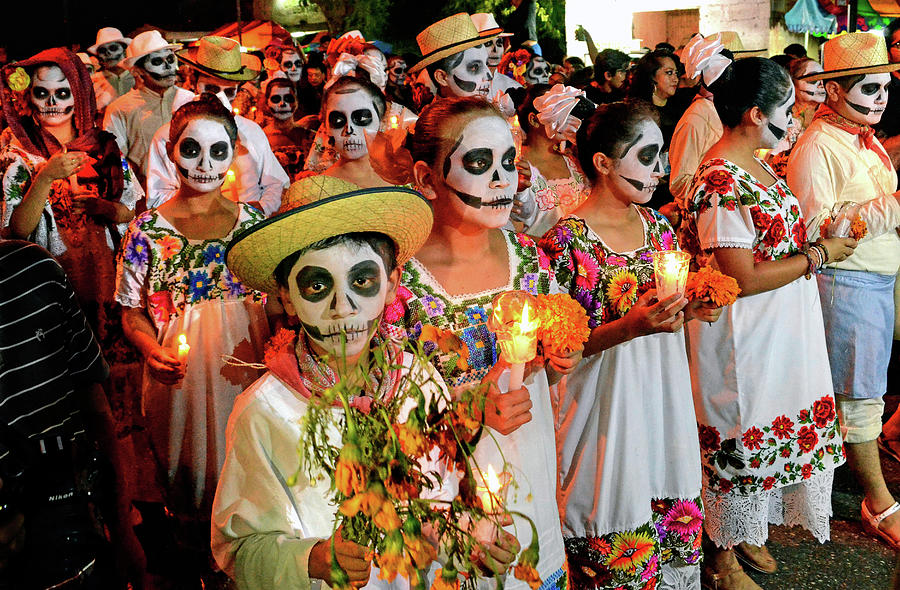
This screenshot has width=900, height=590. Find the location of `orange flowers`. orange flowers is located at coordinates (369, 510), (347, 474), (398, 568), (416, 553), (394, 491), (411, 445).